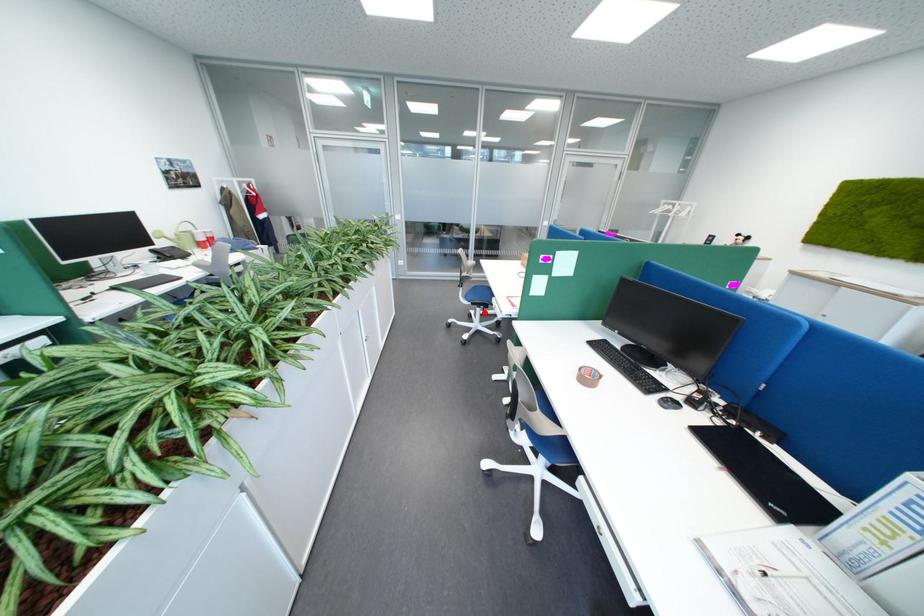
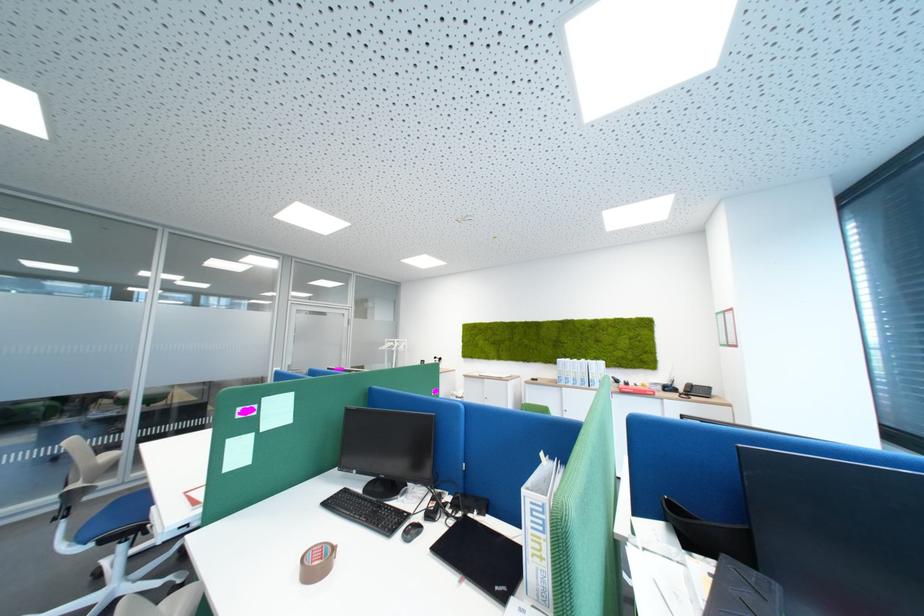
The point at the highlighted location is marked in the first image. Where is the corresponding point in the second image?

(118, 562)